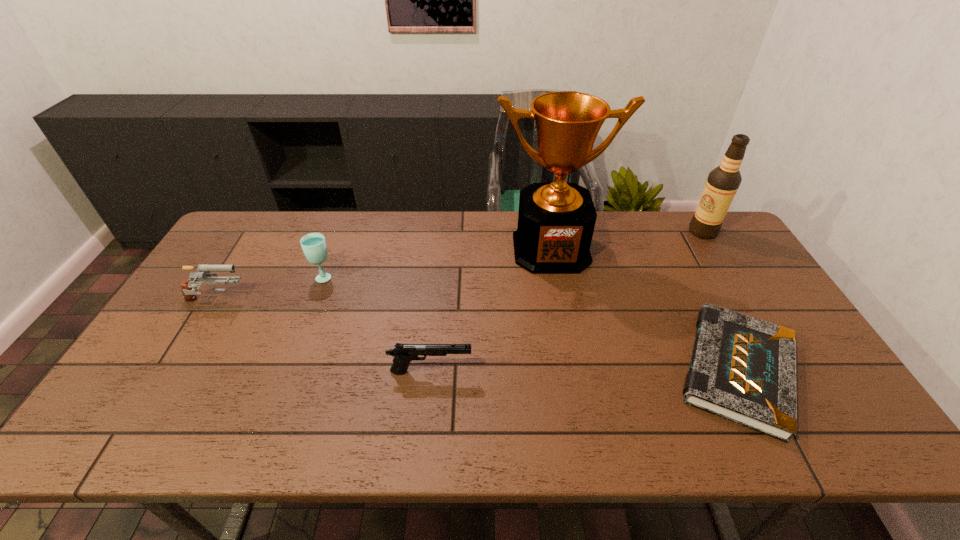
You are a GUI agent. You are given a task and a screenshot of the screen. Output one action in this format:
    pyautogui.click(x=<x>, y=<y>)
    Task: Click on the vacant region between the leftmost object and the glass
    The height and width of the screenshot is (540, 960).
    Given the screenshot: What is the action you would take?
    pyautogui.click(x=270, y=289)

Choose which object is the second nearest neighbor to the right gun. Please provide its 2D coordinates. Your answer should be formatted as a tuple, i.e. [(x, y)], where the tuple contains the x and y coordinates of a point satisfying the conditions above.

[(314, 247)]

The image size is (960, 540). What are the coordinates of `the third closest object to the alcohol` in the screenshot? It's located at (403, 354).

The width and height of the screenshot is (960, 540). In order to click on vacant region that satisfies the following two spatial constraints: 1. on the front side of the shortest object; 2. on the right side of the fifth object from right to left in this screenshot , I will do `click(288, 370)`.

Locate an element on the screen. The image size is (960, 540). free space that satisfies the following two spatial constraints: 1. on the front of the trophy cup with the label; 2. at the aiming end of the nearer gun is located at coordinates (573, 372).